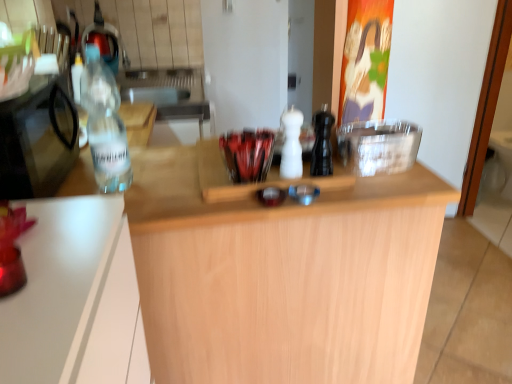
Question: Is light wood countertop at center positioned in front of white matte salt shaker at center, which is the 2th bottle in left-to-right order?

Choices:
 (A) no
 (B) yes

Answer: (B)

Question: Is light wood countertop at center taller than white matte salt shaker at center, which is the 2th bottle in left-to-right order?

Choices:
 (A) yes
 (B) no

Answer: (A)

Question: Can we say light wood countertop at center lies outside white matte salt shaker at center, which is the 2th bottle in left-to-right order?

Choices:
 (A) yes
 (B) no

Answer: (A)

Question: Considering the relative sizes of light wood countertop at center and white matte salt shaker at center, which is the 2th bottle in left-to-right order, in the image provided, is light wood countertop at center smaller than white matte salt shaker at center, which is the 2th bottle in left-to-right order,?

Choices:
 (A) yes
 (B) no

Answer: (B)

Question: Would you say light wood countertop at center contains white matte salt shaker at center, placed as the second bottle when sorted from right to left?

Choices:
 (A) no
 (B) yes

Answer: (A)

Question: Is light wood countertop at center looking in the opposite direction of white matte salt shaker at center, which is the 2th bottle in left-to-right order?

Choices:
 (A) no
 (B) yes

Answer: (A)

Question: Is black matte pepper grinder at center, marked as the third bottle in a left-to-right arrangement, oriented towards light wood countertop at center?

Choices:
 (A) no
 (B) yes

Answer: (A)

Question: Would you say black matte pepper grinder at center, marked as the third bottle in a left-to-right arrangement, is outside light wood countertop at center?

Choices:
 (A) no
 (B) yes

Answer: (B)

Question: From a real-world perspective, is black matte pepper grinder at center, marked as the third bottle in a left-to-right arrangement, positioned over light wood countertop at center based on gravity?

Choices:
 (A) yes
 (B) no

Answer: (A)

Question: Does black matte pepper grinder at center, arranged as the first bottle when viewed from the right, have a greater height compared to light wood countertop at center?

Choices:
 (A) no
 (B) yes

Answer: (A)

Question: Can you confirm if black matte pepper grinder at center, arranged as the first bottle when viewed from the right, is positioned to the left of light wood countertop at center?

Choices:
 (A) no
 (B) yes

Answer: (A)

Question: Is black matte pepper grinder at center, arranged as the first bottle when viewed from the right, far away from light wood countertop at center?

Choices:
 (A) yes
 (B) no

Answer: (B)

Question: Are clear glass bottle at left, the first bottle in the left-to-right sequence, and transparent plastic bottle at left, the first appliance from the left, making contact?

Choices:
 (A) yes
 (B) no

Answer: (B)